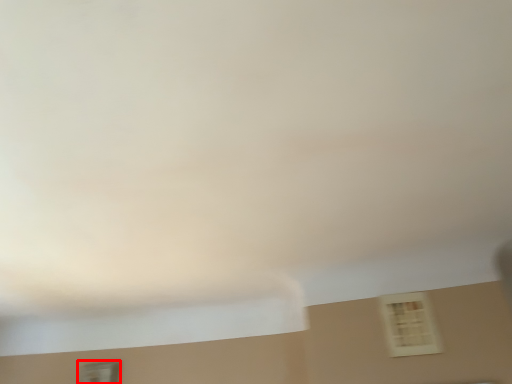
Question: Observing the image, what is the correct spatial positioning of window (annotated by the red box) in reference to window?

Choices:
 (A) right
 (B) left

Answer: (B)